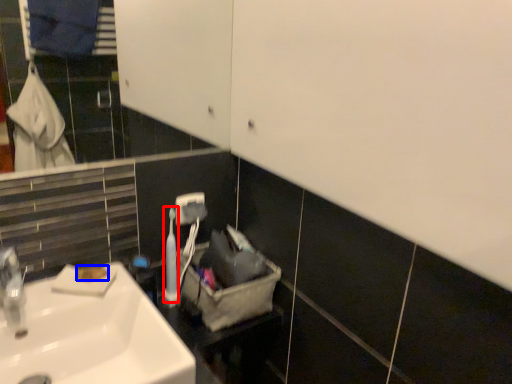
Question: Which point is closer to the camera, toiletry (highlighted by a red box) or soap (highlighted by a blue box)?

Choices:
 (A) toiletry
 (B) soap

Answer: (B)